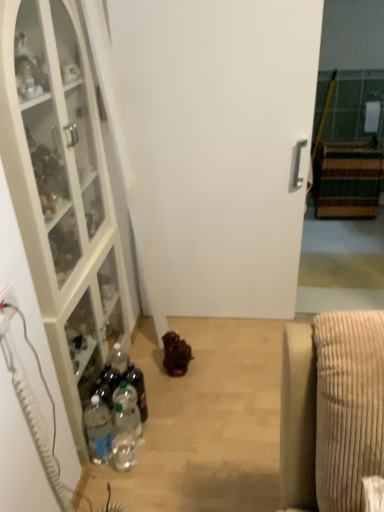
Where is `vacant region to the right of clear plastic bottle at center, the 1th bottle when ordered from right to left`? The height and width of the screenshot is (512, 384). vacant region to the right of clear plastic bottle at center, the 1th bottle when ordered from right to left is located at coordinates pos(183,412).